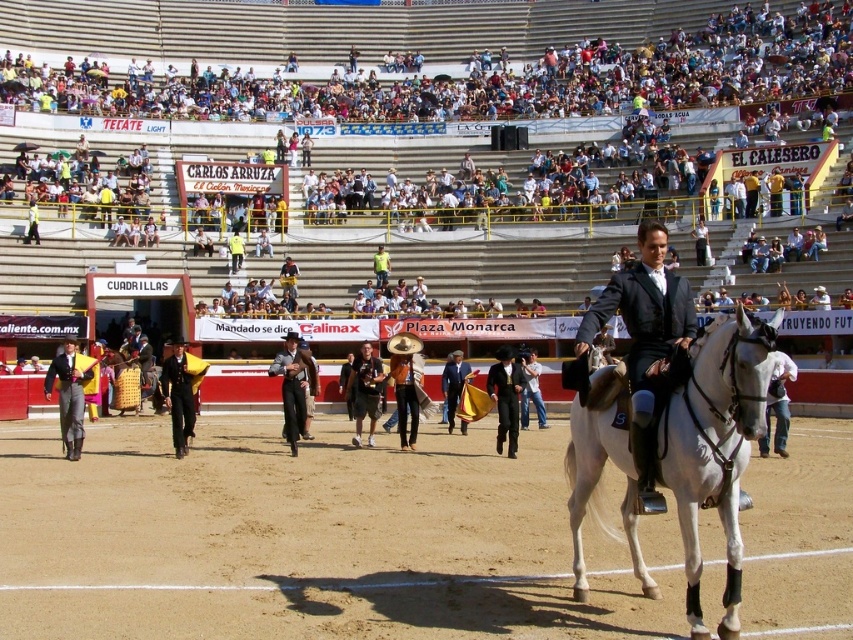
Describe the element at coordinates (465, 136) in the screenshot. I see `white cotton shirt at upper center` at that location.

Between point (314, 298) and point (625, 298), which one is positioned behind?

Positioned behind is point (314, 298).

This screenshot has height=640, width=853. What are the coordinates of `white cotton shirt at upper center` in the screenshot? It's located at (465, 136).

Who is lower down, black satin suit at center or black leather suit at center?

black leather suit at center

Who is taller, black satin suit at center or black leather suit at center?

black satin suit at center

You are a GUI agent. You are given a task and a screenshot of the screen. Output one action in this format:
    pyautogui.click(x=<x>, y=<y>)
    Task: Click on the black satin suit at center
    This screenshot has height=640, width=853.
    Given the screenshot: What is the action you would take?
    pyautogui.click(x=645, y=340)

Does brown sandy dirt track at center appear on the left side of black leather suit at center?

Indeed, brown sandy dirt track at center is positioned on the left side of black leather suit at center.

Does brown sandy dirt track at center have a larger size compared to black leather suit at center?

Yes, brown sandy dirt track at center is bigger than black leather suit at center.

Is point (270, 417) positioned before point (509, 412)?

No, it is behind (509, 412).

The image size is (853, 640). In order to click on brown sandy dirt track at center in this screenshot , I will do coord(308,540).